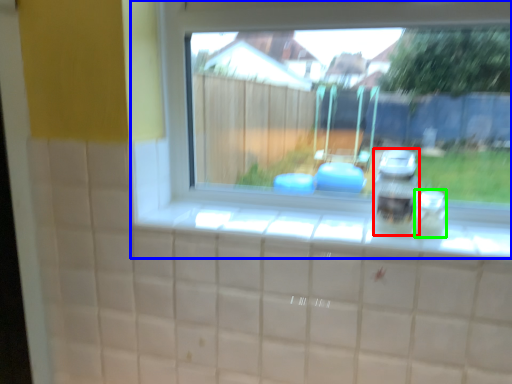
Question: Considering the real-world distances, which object is farthest from appliance (highlighted by a red box)? window (highlighted by a blue box) or glass jar (highlighted by a green box)?

Choices:
 (A) window
 (B) glass jar

Answer: (A)